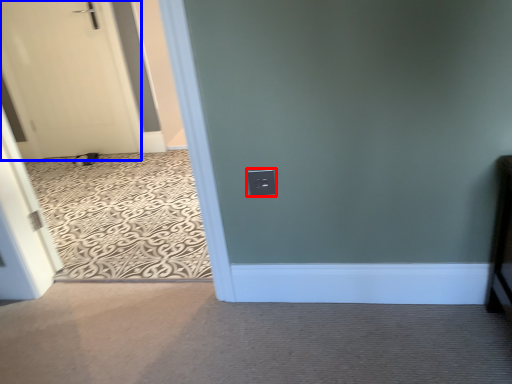
Question: Which point is further to the camera, electric outlet (highlighted by a red box) or door (highlighted by a blue box)?

Choices:
 (A) electric outlet
 (B) door

Answer: (B)